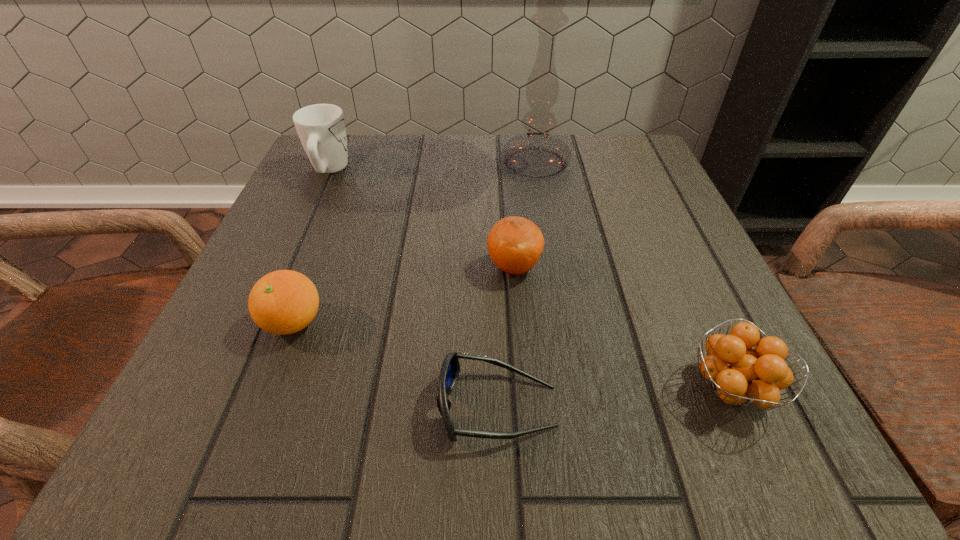
The image size is (960, 540). In order to click on free space that is in between the fourth nearest object and the nearest orange fruit in this screenshot , I will do `click(622, 328)`.

Find the location of a particular element. The height and width of the screenshot is (540, 960). vacant area between the nearest orange fruit and the third nearest object is located at coordinates (512, 355).

This screenshot has height=540, width=960. What are the coordinates of `vacant space that is in between the leftmost orange fruit and the shortest object` in the screenshot? It's located at (396, 364).

At what (x,y) coordinates should I click in order to perform the action: click on free space between the nearest orange fruit and the farthest orange fruit. Please return your answer as a coordinate pair (x, y). The height and width of the screenshot is (540, 960). Looking at the image, I should click on (622, 328).

This screenshot has height=540, width=960. I want to click on vacant space in between the rightmost object and the second orange fruit from left to right, so click(x=622, y=328).

Where is `free space between the third farthest object and the tallest object`? This screenshot has width=960, height=540. free space between the third farthest object and the tallest object is located at coordinates (525, 214).

At what (x,y) coordinates should I click in order to perform the action: click on free spot between the farthest orange fruit and the third nearest object. Please return your answer as a coordinate pair (x, y). The image size is (960, 540). Looking at the image, I should click on (404, 294).

Locate which object ranks second in proximity to the rightmost object. Please provide its 2D coordinates. Your answer should be formatted as a tuple, i.e. [(x, y)], where the tuple contains the x and y coordinates of a point satisfying the conditions above.

[(515, 244)]

Where is `object identified as the fifth closest to the tallest object`? The width and height of the screenshot is (960, 540). object identified as the fifth closest to the tallest object is located at coordinates (450, 369).

This screenshot has height=540, width=960. What are the coordinates of `orange fruit that is the second closest to the sunglasses` in the screenshot? It's located at (738, 373).